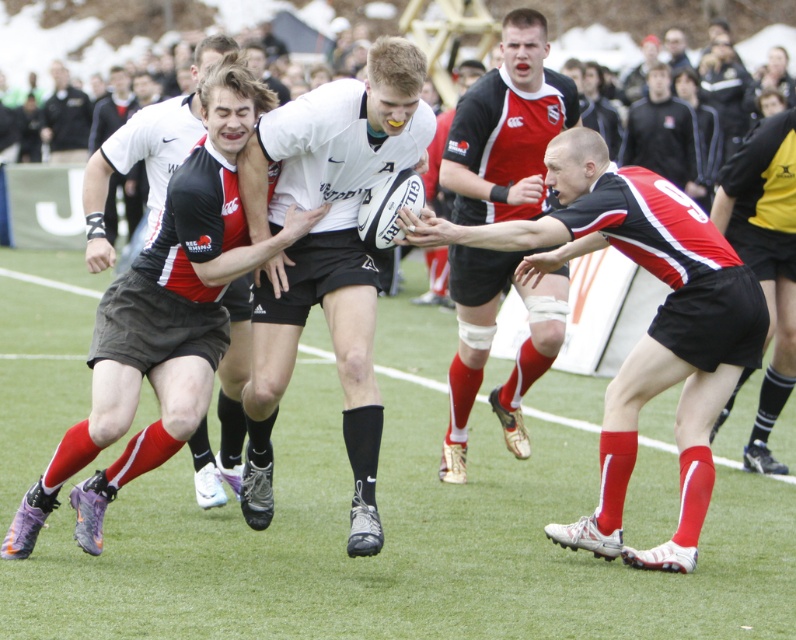
You are a referee observing the rugby match. You notice the red and black jersey at center and the white matte rugby ball at center. Which object is shorter in height?

The red and black jersey at center is not as tall as the white matte rugby ball at center, so the red and black jersey at center is shorter in height.